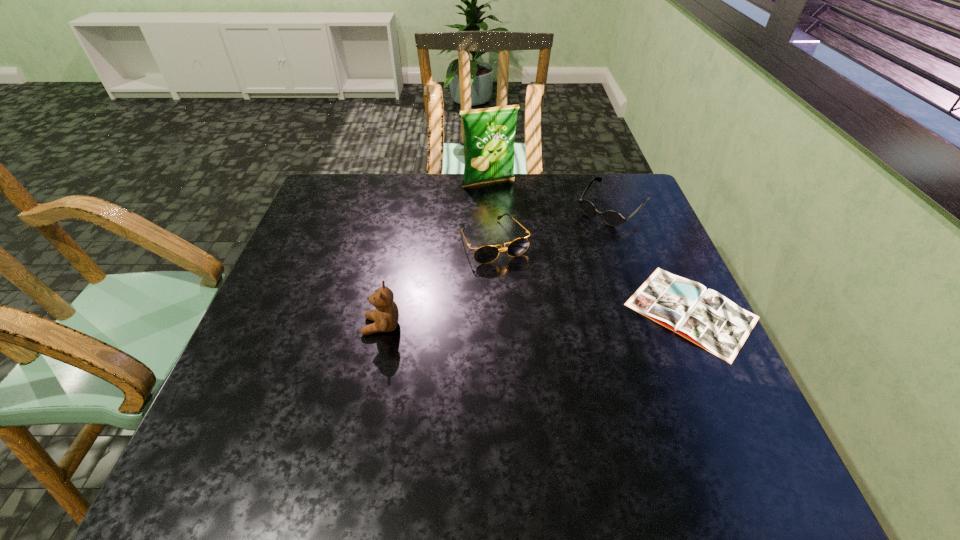
Locate an element on the screen. free space at the near right corner of the desktop is located at coordinates (703, 397).

Find the location of a particular element. The image size is (960, 540). vacant area that lies between the left sunglasses and the shortest object is located at coordinates (592, 276).

What are the coordinates of `vacant space that is in between the right sunglasses and the left sunglasses` in the screenshot? It's located at (553, 224).

At what (x,y) coordinates should I click in order to perform the action: click on vacant space that is in between the right sunglasses and the teddy bear. Please return your answer as a coordinate pair (x, y). Image resolution: width=960 pixels, height=540 pixels. Looking at the image, I should click on (496, 267).

Find the location of `free area in between the book and the tallest object`. free area in between the book and the tallest object is located at coordinates (589, 247).

The image size is (960, 540). In order to click on unoccupied position between the shortest object and the right sunglasses in this screenshot , I will do `click(652, 259)`.

Locate an element on the screen. The width and height of the screenshot is (960, 540). free space that is in between the tallest object and the leftmost object is located at coordinates (435, 254).

Identify the location of free point between the tallest object and the shortest object. The image size is (960, 540). (589, 247).

Where is `vacant space in between the leftmost object and the right sunglasses`? The image size is (960, 540). vacant space in between the leftmost object and the right sunglasses is located at coordinates (496, 267).

What are the coordinates of `free space between the fourth shortest object and the tallest object` in the screenshot? It's located at (435, 254).